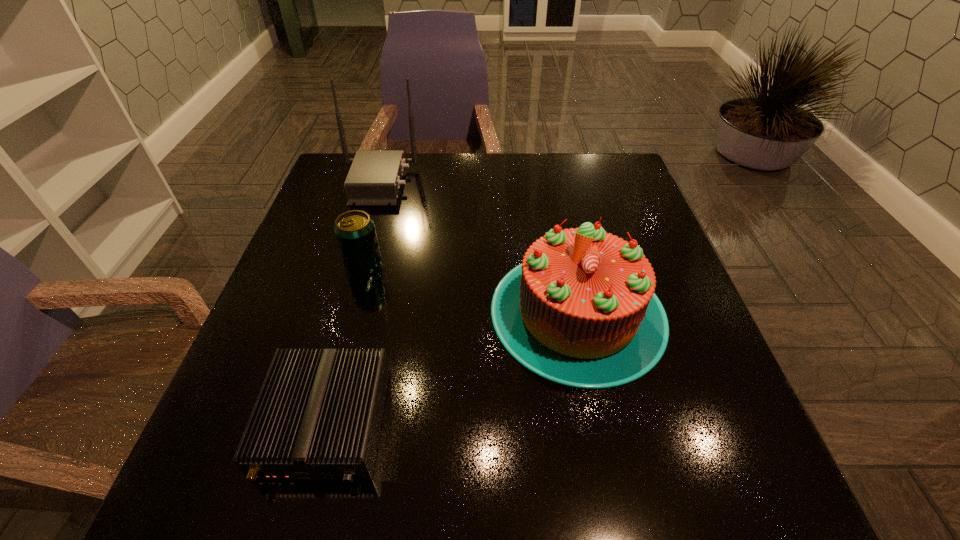
Locate an element on the screen. The image size is (960, 540). empty space between the shorter router and the second tallest object is located at coordinates (452, 367).

At what (x,y) coordinates should I click in order to perform the action: click on unoccupied area between the beer can and the rightmost object. Please return your answer as a coordinate pair (x, y). The width and height of the screenshot is (960, 540). Looking at the image, I should click on (470, 288).

Where is `vacant area that lies between the third tallest object and the third shortest object`? The image size is (960, 540). vacant area that lies between the third tallest object and the third shortest object is located at coordinates (470, 288).

Locate an element on the screen. This screenshot has width=960, height=540. empty location between the shorter router and the beer can is located at coordinates (345, 343).

The width and height of the screenshot is (960, 540). I want to click on free area in between the beer can and the cake, so click(x=470, y=288).

Image resolution: width=960 pixels, height=540 pixels. Find the location of `free area in between the nearer router and the second tallest object`. free area in between the nearer router and the second tallest object is located at coordinates (452, 367).

Find the location of a particular element. The width and height of the screenshot is (960, 540). free point between the second shortest object and the nearer router is located at coordinates (345, 343).

You are a GUI agent. You are given a task and a screenshot of the screen. Output one action in this format:
    pyautogui.click(x=<x>, y=<y>)
    Task: Click on the vacant point located between the shortest object and the farthest object
    
    Given the screenshot: What is the action you would take?
    pyautogui.click(x=352, y=302)

What are the coordinates of `blank region between the farther router and the nearer router` in the screenshot? It's located at (352, 302).

At what (x,y) coordinates should I click in order to perform the action: click on object that can be found as the closest to the taller router. Please return your answer as a coordinate pair (x, y). Image resolution: width=960 pixels, height=540 pixels. Looking at the image, I should click on (355, 232).